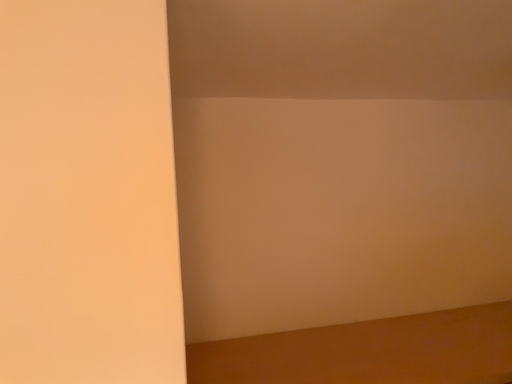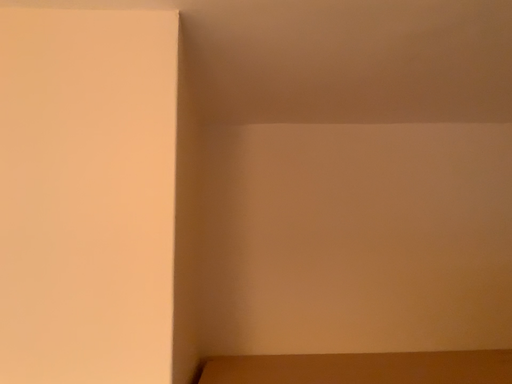
Question: How did the camera likely rotate when shooting the video?

Choices:
 (A) rotated left
 (B) rotated right

Answer: (A)